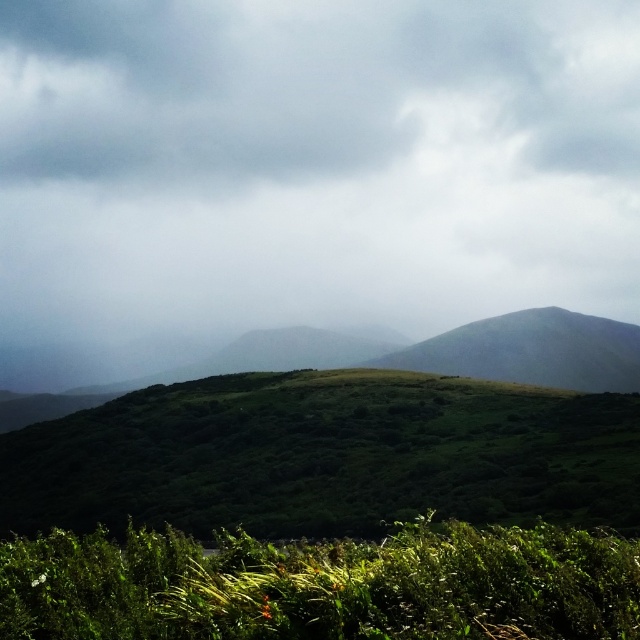
Which is below, gray cloudy sky at upper center or green leafy grass at lower center?

green leafy grass at lower center is lower down.

Consider the image. Is gray cloudy sky at upper center closer to camera compared to green leafy grass at lower center?

No, gray cloudy sky at upper center is further to the viewer.

Which is behind, point (362, 76) or point (483, 595)?

Point (362, 76)

Identify the location of gray cloudy sky at upper center. The height and width of the screenshot is (640, 640). (305, 172).

Is gray cloudy sky at upper center shorter than green leafy vegetation at center?

No, gray cloudy sky at upper center is not shorter than green leafy vegetation at center.

From the picture: Who is positioned more to the right, gray cloudy sky at upper center or green leafy vegetation at center?

Positioned to the right is green leafy vegetation at center.

Between point (196, 58) and point (285, 394), which one is positioned behind?

Positioned behind is point (196, 58).

At what (x,y) coordinates should I click in order to perform the action: click on gray cloudy sky at upper center. Please return your answer as a coordinate pair (x, y). Looking at the image, I should click on (305, 172).

Looking at this image, is the position of green leafy vegetation at center less distant than that of green leafy grass at lower center?

No, green leafy vegetation at center is further to the viewer.

Which of these two, green leafy vegetation at center or green leafy grass at lower center, stands taller?

green leafy vegetation at center

At what (x,y) coordinates should I click in order to perform the action: click on green leafy vegetation at center. Please return your answer as a coordinate pair (x, y). The image size is (640, 640). Looking at the image, I should click on (326, 456).